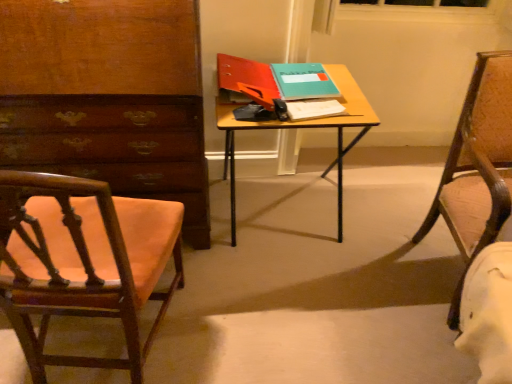
Find the location of a particular element. This screenshot has width=512, height=384. free space between leather-like brown chair at right, the first chair from the right, and wooden chair at left, acting as the first chair starting from the left is located at coordinates (303, 310).